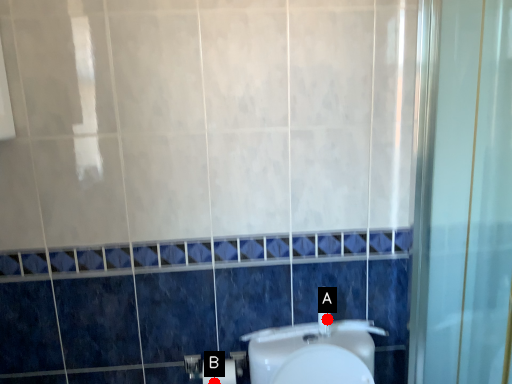
Question: Two points are circled on the image, labeled by A and B beside each circle. Among these points, which one is farthest from the camera?

Choices:
 (A) A is further
 (B) B is further

Answer: (A)